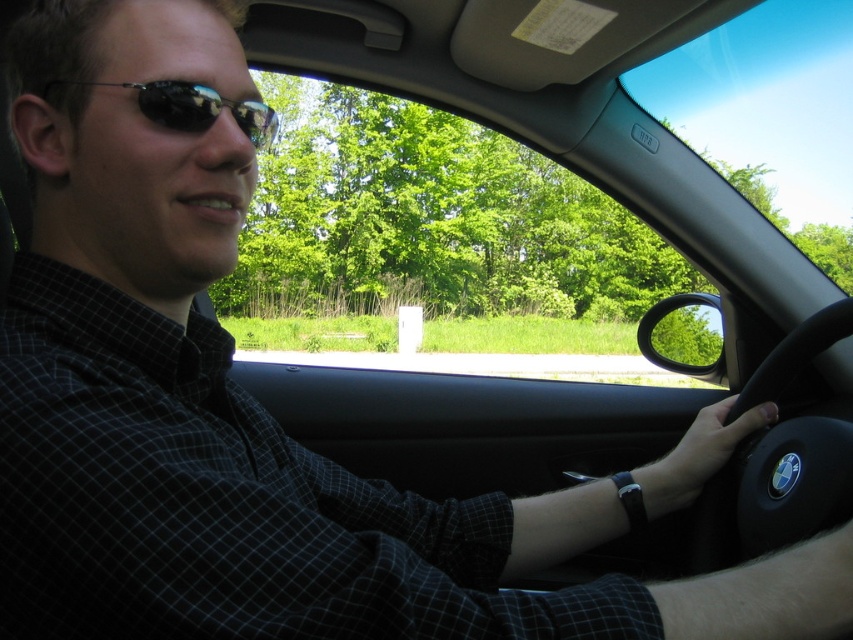
Question: From the image, what is the correct spatial relationship of black leather steering wheel at lower right in relation to sunglasses at left?

Choices:
 (A) right
 (B) left

Answer: (A)

Question: Considering the relative positions of black leather steering wheel at lower right and sunglasses at left in the image provided, where is black leather steering wheel at lower right located with respect to sunglasses at left?

Choices:
 (A) right
 (B) left

Answer: (A)

Question: Is black leather steering wheel at lower right smaller than sunglasses at left?

Choices:
 (A) yes
 (B) no

Answer: (B)

Question: Among these points, which one is nearest to the camera?

Choices:
 (A) (276, 125)
 (B) (761, 492)

Answer: (A)